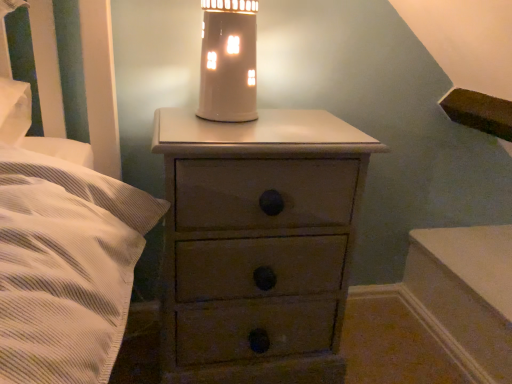
Question: Does point (219, 26) appear closer or farther from the camera than point (180, 340)?

Choices:
 (A) farther
 (B) closer

Answer: (B)

Question: From the image's perspective, is matte white oil lamp at upper center positioned above or below matte brown chest of drawers at center?

Choices:
 (A) below
 (B) above

Answer: (B)

Question: In terms of width, does matte white oil lamp at upper center look wider or thinner when compared to matte brown chest of drawers at center?

Choices:
 (A) thin
 (B) wide

Answer: (A)

Question: In the image, is matte brown chest of drawers at center positioned in front of or behind matte white oil lamp at upper center?

Choices:
 (A) front
 (B) behind

Answer: (A)

Question: From a real-world perspective, relative to matte white oil lamp at upper center, is matte brown chest of drawers at center vertically above or below?

Choices:
 (A) above
 (B) below

Answer: (B)

Question: Is matte brown chest of drawers at center wider or thinner than matte white oil lamp at upper center?

Choices:
 (A) thin
 (B) wide

Answer: (B)

Question: From their relative heights in the image, would you say matte brown chest of drawers at center is taller or shorter than matte white oil lamp at upper center?

Choices:
 (A) tall
 (B) short

Answer: (A)